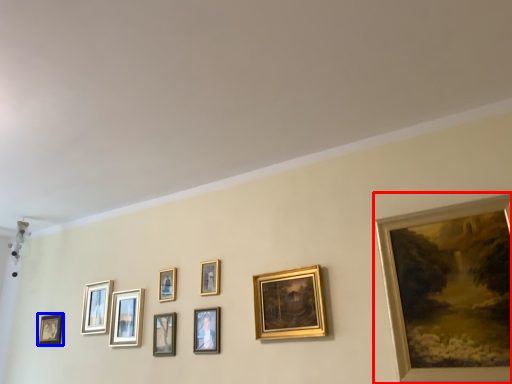
Question: Which point is closer to the camera, picture frame (highlighted by a red box) or picture frame (highlighted by a blue box)?

Choices:
 (A) picture frame
 (B) picture frame

Answer: (A)